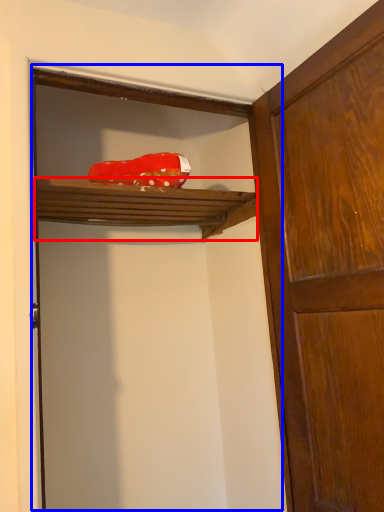
Question: Among these objects, which one is farthest to the camera, shelf (highlighted by a red box) or door (highlighted by a blue box)?

Choices:
 (A) shelf
 (B) door

Answer: (A)